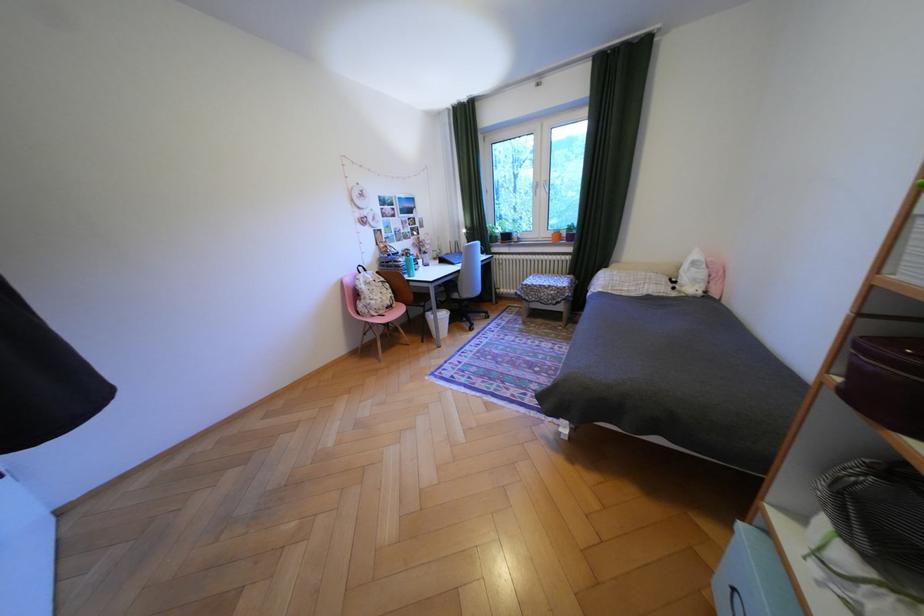
Where is `pink chair sitting surface`? The image size is (924, 616). pink chair sitting surface is located at coordinates [391, 314].